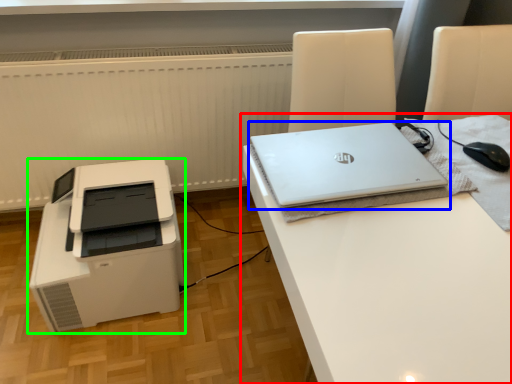
Question: Which object is the farthest from desk (highlighted by a red box)? Choose among these: laptop (highlighted by a blue box) or printer (highlighted by a green box).

Choices:
 (A) laptop
 (B) printer

Answer: (B)